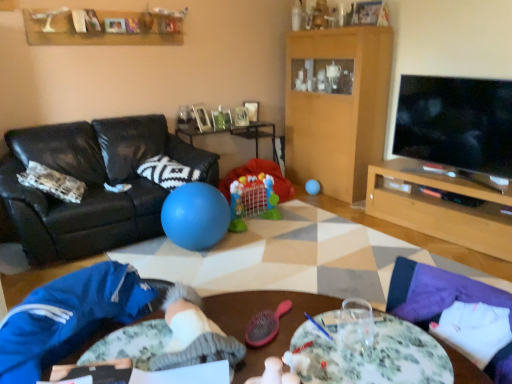
Where is `white knitted pillow at center`? The image size is (512, 384). white knitted pillow at center is located at coordinates [x=167, y=172].

This screenshot has width=512, height=384. I want to click on flat screen tv at right, so click(x=456, y=124).

The height and width of the screenshot is (384, 512). Describe the element at coordinates (337, 106) in the screenshot. I see `wooden cabinet at center` at that location.

The image size is (512, 384). What do you see at coordinates (259, 311) in the screenshot?
I see `floral-patterned glass at center` at bounding box center [259, 311].

This screenshot has width=512, height=384. I want to click on white knitted pillow at center, so point(167,172).

Is smooth plastic ball at center, which is counted as the 1th table, starting from the left, facing towards plastic colorful playpen at center?

Yes, smooth plastic ball at center, which is counted as the 1th table, starting from the left, is turned towards plastic colorful playpen at center.

Would you consider smooth plastic ball at center, the 1th table positioned from the back, to be distant from plastic colorful playpen at center?

smooth plastic ball at center, the 1th table positioned from the back, is actually quite close to plastic colorful playpen at center.

Considering the sizes of objects smooth plastic ball at center, the 1th table positioned from the back, and plastic colorful playpen at center in the image provided, who is bigger, smooth plastic ball at center, the 1th table positioned from the back, or plastic colorful playpen at center?

Bigger between the two is smooth plastic ball at center, the 1th table positioned from the back.

From the picture: Measure the distance between smooth plastic ball at center, which is counted as the 1th table, starting from the left, and plastic colorful playpen at center.

smooth plastic ball at center, which is counted as the 1th table, starting from the left, and plastic colorful playpen at center are 25.86 inches apart from each other.

Between point (228, 179) and point (449, 153), which one is positioned in front?

The point (449, 153) is more forward.

Is plastic colorful playpen at center taller than flat screen tv at right?

In fact, plastic colorful playpen at center may be shorter than flat screen tv at right.

This screenshot has width=512, height=384. What are the coordinates of `toy behind the flat screen tv at right` in the screenshot? It's located at (256, 191).

Is plastic colorful playpen at center inside the boundaries of flat screen tv at right, or outside?

plastic colorful playpen at center is not inside flat screen tv at right, it's outside.

Considering the relative sizes of smooth plastic ball at center, which is counted as the 1th table, starting from the left, and matte blue ball at center, which ranks as the first ball in right-to-left order, in the image provided, is smooth plastic ball at center, which is counted as the 1th table, starting from the left, bigger than matte blue ball at center, which ranks as the first ball in right-to-left order,?

Correct, smooth plastic ball at center, which is counted as the 1th table, starting from the left, is larger in size than matte blue ball at center, which ranks as the first ball in right-to-left order.

Who is shorter, smooth plastic ball at center, the 1th table positioned from the back, or matte blue ball at center, which appears as the second ball when viewed from the front?

matte blue ball at center, which appears as the second ball when viewed from the front, is shorter.

Locate an element on the screen. The height and width of the screenshot is (384, 512). the 1st ball positioned below the smooth plastic ball at center, which is counted as the 1th table, starting from the left (from the image's perspective) is located at coordinates (312, 187).

From the image's perspective, is smooth plastic ball at center, the 2th table viewed from the right, on top of matte blue ball at center, which appears as the second ball when viewed from the front?

Indeed, from the image's perspective, smooth plastic ball at center, the 2th table viewed from the right, is shown above matte blue ball at center, which appears as the second ball when viewed from the front.

In terms of width, does wooden tv stand at right, which is the second table in back-to-front order, look wider or thinner when compared to white knitted pillow at center?

wooden tv stand at right, which is the second table in back-to-front order, is thinner than white knitted pillow at center.

Which is more to the left, wooden tv stand at right, placed as the 1th table when sorted from front to back, or white knitted pillow at center?

white knitted pillow at center.

Is white knitted pillow at center at the back of wooden tv stand at right, placed as the 1th table when sorted from front to back?

That's not correct — wooden tv stand at right, placed as the 1th table when sorted from front to back, is not looking away from white knitted pillow at center.

Considering the sizes of objects wooden tv stand at right, placed as the 1th table when sorted from front to back, and white knitted pillow at center in the image provided, who is bigger, wooden tv stand at right, placed as the 1th table when sorted from front to back, or white knitted pillow at center?

With larger size is wooden tv stand at right, placed as the 1th table when sorted from front to back.

Locate an element on the screen. This screenshot has width=512, height=384. the 2nd picture frame located above the blue rubber ball at center, the 1th ball from the left (from a real-world perspective) is located at coordinates (201, 117).

Based on the photo, is blue rubber ball at center, which appears as the 2th ball when viewed from the back, inside or outside of wooden picture frame at upper center, marked as the second picture frame in a back-to-front arrangement?

The correct answer is: outside.

In the scene shown: Would you consider blue rubber ball at center, which appears as the 2th ball when viewed from the back, to be distant from wooden picture frame at upper center, marked as the second picture frame in a back-to-front arrangement?

blue rubber ball at center, which appears as the 2th ball when viewed from the back, is far away from wooden picture frame at upper center, marked as the second picture frame in a back-to-front arrangement.

Could you tell me if matte blue ball at center, the 2th ball viewed from the left, is turned towards wooden tv stand at right, the first table positioned from the right?

Yes, matte blue ball at center, the 2th ball viewed from the left, is turned towards wooden tv stand at right, the first table positioned from the right.

Is matte blue ball at center, which is counted as the 1th ball, starting from the back, surrounding wooden tv stand at right, the first table positioned from the right?

No, wooden tv stand at right, the first table positioned from the right, is not a part of matte blue ball at center, which is counted as the 1th ball, starting from the back.

Considering the points (313, 184) and (391, 161), which point is behind, point (313, 184) or point (391, 161)?

Point (313, 184)

Considering the relative sizes of matte blue ball at center, which ranks as the first ball in right-to-left order, and wooden tv stand at right, which is the second table in back-to-front order, in the image provided, is matte blue ball at center, which ranks as the first ball in right-to-left order, taller than wooden tv stand at right, which is the second table in back-to-front order,?

Incorrect, the height of matte blue ball at center, which ranks as the first ball in right-to-left order, is not larger of that of wooden tv stand at right, which is the second table in back-to-front order.

In the image, is wooden picture frame at upper center, the first picture frame positioned from the right, positioned in front of or behind plastic colorful playpen at center?

wooden picture frame at upper center, the first picture frame positioned from the right, is behind plastic colorful playpen at center.

Is wooden picture frame at upper center, the second picture frame in the left-to-right sequence, facing away from plastic colorful playpen at center?

wooden picture frame at upper center, the second picture frame in the left-to-right sequence, is not turned away from plastic colorful playpen at center.

Does wooden picture frame at upper center, arranged as the second picture frame when viewed from the front, have a lesser height compared to plastic colorful playpen at center?

Yes, wooden picture frame at upper center, arranged as the second picture frame when viewed from the front, is shorter than plastic colorful playpen at center.

The width and height of the screenshot is (512, 384). I want to click on table that appears on the left of plastic colorful playpen at center, so click(238, 134).

Find the location of a particular element. The width and height of the screenshot is (512, 384). toy directly beneath the flat screen tv at right (from a real-world perspective) is located at coordinates (256, 191).

Estimate the real-world distances between objects in this image. Which object is further from flat screen tv at right, smooth plastic ball at center, the 2th table viewed from the right, or wooden cabinet at center?

smooth plastic ball at center, the 2th table viewed from the right, is further to flat screen tv at right.

Which object lies further to the anchor point wooden cabinet at center, smooth plastic ball at center, which is the 2th table in front-to-back order, or floral fabric table at lower right?

floral fabric table at lower right.

In the scene shown: From the image, which object appears to be farther from smooth plastic ball at center, which is counted as the 1th table, starting from the left, white knitted pillow at center or flat screen tv at right?

Based on the image, flat screen tv at right appears to be further to smooth plastic ball at center, which is counted as the 1th table, starting from the left.

When comparing their distances from floral fabric table at lower right, does plastic colorful playpen at center or blue fleece pants at lower left seem closer?

The object closer to floral fabric table at lower right is blue fleece pants at lower left.

Looking at the image, which one is located further to floral fabric table at lower right, flat screen tv at right or matte blue ball at center, which ranks as the first ball in right-to-left order?

matte blue ball at center, which ranks as the first ball in right-to-left order, is further to floral fabric table at lower right.

When comparing their distances from black leather couch at left, does plastic colorful playpen at center or matte blue ball at center, the 2th ball viewed from the left, seem further?

matte blue ball at center, the 2th ball viewed from the left, is positioned further to the anchor black leather couch at left.

When comparing their distances from wooden tv stand at right, the first table positioned from the right, does floral fabric table at lower right or black leather couch at left seem further?

Based on the image, floral fabric table at lower right appears to be further to wooden tv stand at right, the first table positioned from the right.

Considering their positions, is white knitted pillow at center positioned closer to smooth plastic ball at center, the 2th table viewed from the right, than plastic colorful playpen at center?

Among the two, plastic colorful playpen at center is located nearer to smooth plastic ball at center, the 2th table viewed from the right.

Locate an element on the screen. This screenshot has width=512, height=384. picture frame between blue fleece pants at lower left and wooden picture frame at upper center, the second picture frame in the left-to-right sequence, in the front-back direction is located at coordinates (201, 117).

The width and height of the screenshot is (512, 384). I want to click on television located between blue fleece pants at lower left and matte blue ball at center, the 2th ball viewed from the left, in the depth direction, so click(x=456, y=124).

I want to click on studio couch between blue fleece pants at lower left and smooth plastic ball at center, the 1th table positioned from the back, from front to back, so pos(93,184).

Where is `cabinetry between white knitted pillow at center and wooden tv stand at right, which is the second table in back-to-front order`? cabinetry between white knitted pillow at center and wooden tv stand at right, which is the second table in back-to-front order is located at coordinates (337, 106).